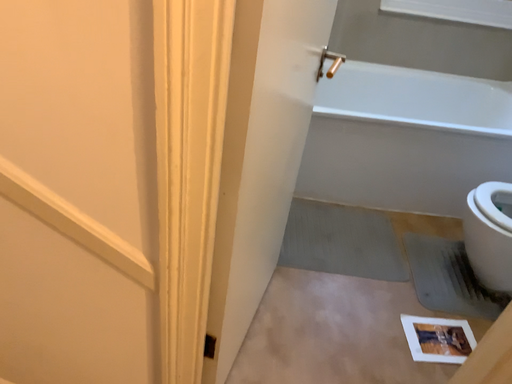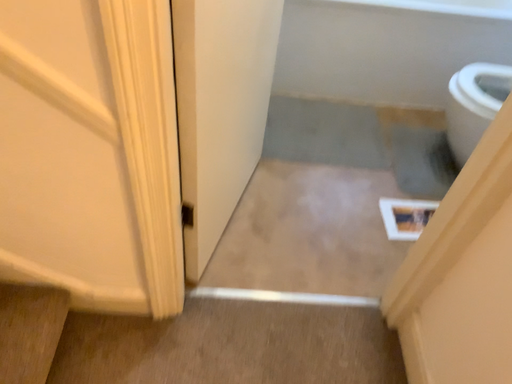
Question: Which way did the camera rotate in the video?

Choices:
 (A) rotated downward
 (B) rotated upward

Answer: (A)